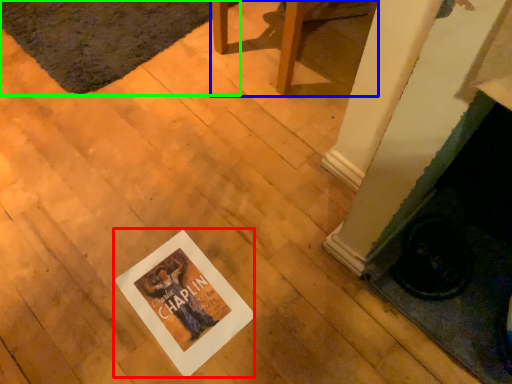
Question: Estimate the real-world distances between objects in this image. Which object is farther from postcard (highlighted by a red box), furniture (highlighted by a blue box) or mat (highlighted by a green box)?

Choices:
 (A) furniture
 (B) mat

Answer: (B)